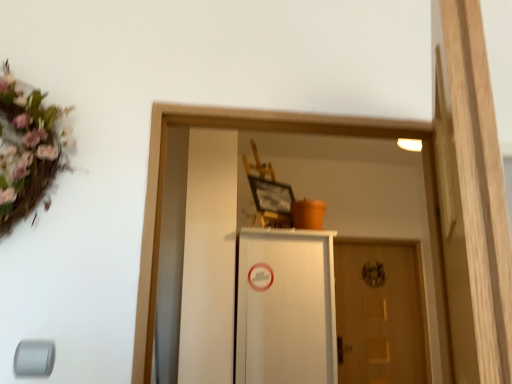
Question: From the image's perspective, would you say wooden door at center is positioned over white matte cabinet at center?

Choices:
 (A) yes
 (B) no

Answer: (B)

Question: From a real-world perspective, is wooden door at center located beneath white matte cabinet at center?

Choices:
 (A) yes
 (B) no

Answer: (A)

Question: Does wooden door at center have a larger size compared to white matte cabinet at center?

Choices:
 (A) no
 (B) yes

Answer: (A)

Question: Can you confirm if wooden door at center is smaller than white matte cabinet at center?

Choices:
 (A) yes
 (B) no

Answer: (A)

Question: From a real-world perspective, is wooden door at center over white matte cabinet at center?

Choices:
 (A) no
 (B) yes

Answer: (A)

Question: Would you say wooden door at center contains white matte cabinet at center?

Choices:
 (A) yes
 (B) no

Answer: (B)

Question: Considering the relative sizes of white matte cabinet at center and wooden door at center in the image provided, is white matte cabinet at center thinner than wooden door at center?

Choices:
 (A) no
 (B) yes

Answer: (A)

Question: Can you confirm if white matte cabinet at center is smaller than wooden door at center?

Choices:
 (A) no
 (B) yes

Answer: (A)

Question: Is white matte cabinet at center oriented away from wooden door at center?

Choices:
 (A) yes
 (B) no

Answer: (B)

Question: From a real-world perspective, does white matte cabinet at center sit lower than wooden door at center?

Choices:
 (A) yes
 (B) no

Answer: (B)

Question: Does white matte cabinet at center have a greater width compared to wooden door at center?

Choices:
 (A) yes
 (B) no

Answer: (A)

Question: From the image's perspective, is white matte cabinet at center over wooden door at center?

Choices:
 (A) no
 (B) yes

Answer: (B)

Question: Is point pyautogui.click(x=243, y=360) positioned closer to the camera than point pyautogui.click(x=373, y=357)?

Choices:
 (A) closer
 (B) farther

Answer: (A)